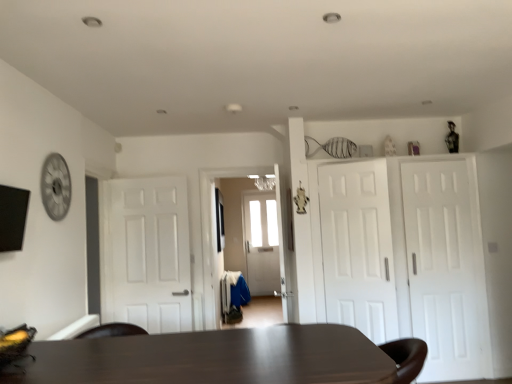
Question: Is white matte door at right, which is the 2th door in right-to-left order, touching dark brown wooden table at center?

Choices:
 (A) no
 (B) yes

Answer: (A)

Question: Is dark brown wooden table at center at the back of white matte door at right, which is the 2th door in right-to-left order?

Choices:
 (A) no
 (B) yes

Answer: (A)

Question: Is white matte door at right, the 3th door in the left-to-right sequence, positioned far away from dark brown wooden table at center?

Choices:
 (A) no
 (B) yes

Answer: (B)

Question: From the image's perspective, is white matte door at right, which is the 2th door in right-to-left order, above dark brown wooden table at center?

Choices:
 (A) no
 (B) yes

Answer: (B)

Question: Considering the relative sizes of white matte door at right, the 3th door in the left-to-right sequence, and dark brown wooden table at center in the image provided, is white matte door at right, the 3th door in the left-to-right sequence, taller than dark brown wooden table at center?

Choices:
 (A) yes
 (B) no

Answer: (A)

Question: Is white matte door at center, which appears as the 3th door when viewed from the right, bigger or smaller than white matte door at right, which is counted as the 1th door, starting from the right?

Choices:
 (A) big
 (B) small

Answer: (B)

Question: In terms of height, does white matte door at center, acting as the 2th door starting from the left, look taller or shorter compared to white matte door at right, positioned as the 4th door in left-to-right order?

Choices:
 (A) short
 (B) tall

Answer: (A)

Question: Is point (392, 263) closer or farther from the camera than point (423, 367)?

Choices:
 (A) closer
 (B) farther

Answer: (B)

Question: From a real-world perspective, is white matte door at center, which appears as the 3th door when viewed from the right, physically located above or below white matte door at right, positioned as the 4th door in left-to-right order?

Choices:
 (A) below
 (B) above

Answer: (B)

Question: Choose the correct answer: Is dark brown wooden table at center inside white matte door at center, which appears as the 3th door when viewed from the right, or outside it?

Choices:
 (A) outside
 (B) inside

Answer: (A)

Question: From the image's perspective, is dark brown wooden table at center located above or below white matte door at center, acting as the 2th door starting from the left?

Choices:
 (A) above
 (B) below

Answer: (B)

Question: From a real-world perspective, is dark brown wooden table at center positioned above or below white matte door at center, which appears as the 3th door when viewed from the right?

Choices:
 (A) below
 (B) above

Answer: (A)

Question: Based on their sizes in the image, would you say dark brown wooden table at center is bigger or smaller than white matte door at center, acting as the 2th door starting from the left?

Choices:
 (A) big
 (B) small

Answer: (A)

Question: From a real-world perspective, is dark brown wooden table at center above or below white matte door at right, positioned as the 4th door in left-to-right order?

Choices:
 (A) below
 (B) above

Answer: (A)

Question: Is point (228, 352) positioned closer to the camera than point (463, 354)?

Choices:
 (A) closer
 (B) farther

Answer: (A)